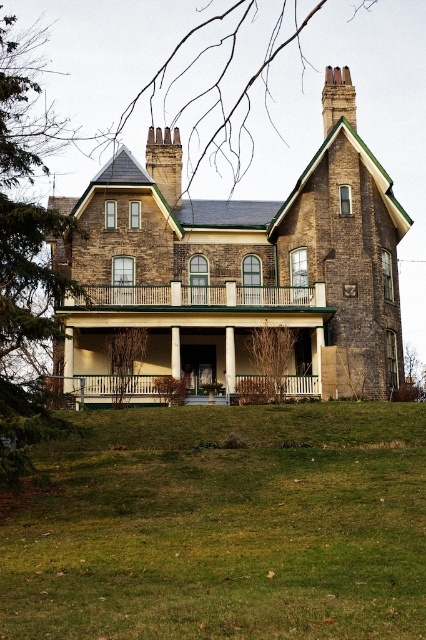
Question: Estimate the real-world distances between objects in this image. Which object is farther from the white painted wood pillar at center?

Choices:
 (A) green grass at lower center
 (B) brown textured tree at center
 (C) white painted wood porch at center
 (D) white wood column at center

Answer: (A)

Question: Is white painted wood porch at center to the left of white painted wood pillar at center from the viewer's perspective?

Choices:
 (A) no
 (B) yes

Answer: (B)

Question: Observing the image, what is the correct spatial positioning of green grass at lower center in reference to brown textured tree at center?

Choices:
 (A) below
 (B) above

Answer: (A)

Question: Can you confirm if green grass at lower center is wider than bare branches at upper center?

Choices:
 (A) no
 (B) yes

Answer: (A)

Question: Which point appears closest to the camera in this image?

Choices:
 (A) (259, 81)
 (B) (189, 397)
 (C) (253, 349)
 (D) (175, 358)

Answer: (B)

Question: Which point is closer to the camera taking this photo?

Choices:
 (A) (175, 356)
 (B) (250, 376)

Answer: (B)